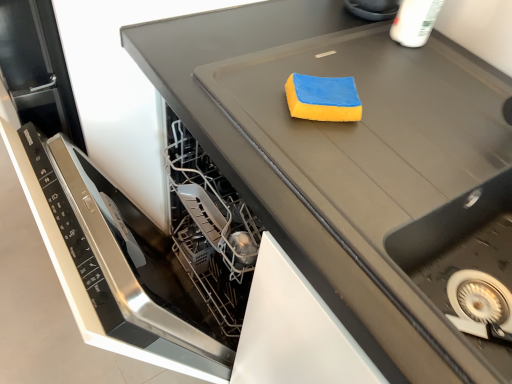
I want to click on free spot to the left of blue sponge at center, so click(x=253, y=82).